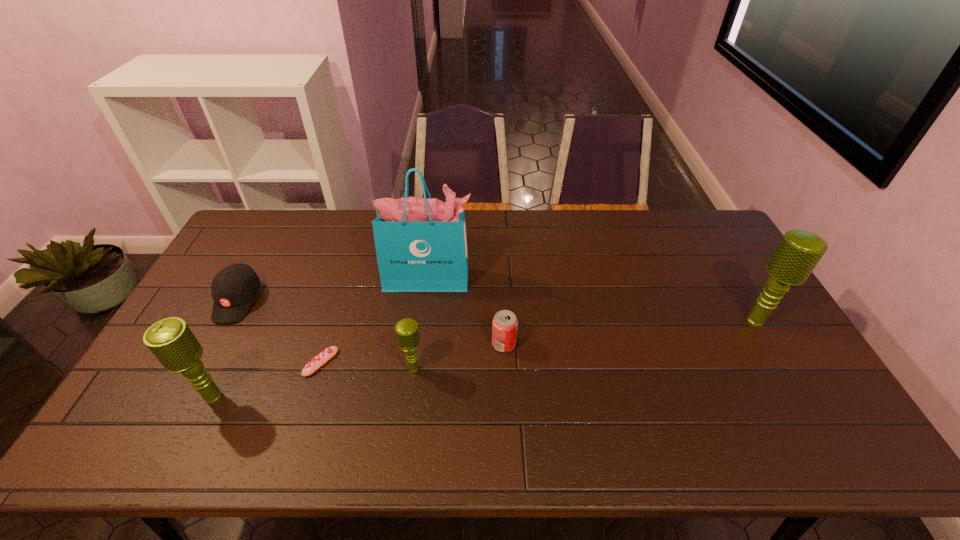
Image resolution: width=960 pixels, height=540 pixels. What are the coordinates of `vacant area that satisfies the following two spatial constraints: 1. with a logo on the front of the soda can; 2. on the right side of the baseball cap` in the screenshot? It's located at (214, 344).

You are a GUI agent. You are given a task and a screenshot of the screen. Output one action in this format:
    pyautogui.click(x=<x>, y=<y>)
    Task: Click on the free space in the image that satisfies the following two spatial constraints: 1. with a logo on the front of the second microphone from right to left; 2. on the left side of the sixth tallest object
    
    Given the screenshot: What is the action you would take?
    pyautogui.click(x=201, y=369)

Where is `free spot that satisfies the following two spatial constraints: 1. with a logo on the front of the second microphone from left to right; 2. on the left side of the second shortest object`? free spot that satisfies the following two spatial constraints: 1. with a logo on the front of the second microphone from left to right; 2. on the left side of the second shortest object is located at coordinates (201, 369).

Find the location of a particular element. Image resolution: width=960 pixels, height=540 pixels. free location that satisfies the following two spatial constraints: 1. on the back side of the farthest microphone; 2. on the left side of the shortest microphone is located at coordinates (420, 321).

Locate an element on the screen. This screenshot has width=960, height=540. free space that satisfies the following two spatial constraints: 1. with a logo on the front of the baseball cap; 2. on the right side of the second farthest microphone is located at coordinates (201, 369).

Identify the location of free space that satisfies the following two spatial constraints: 1. on the back side of the second object from right to left; 2. on the right side of the fourth shortest object. (417, 344).